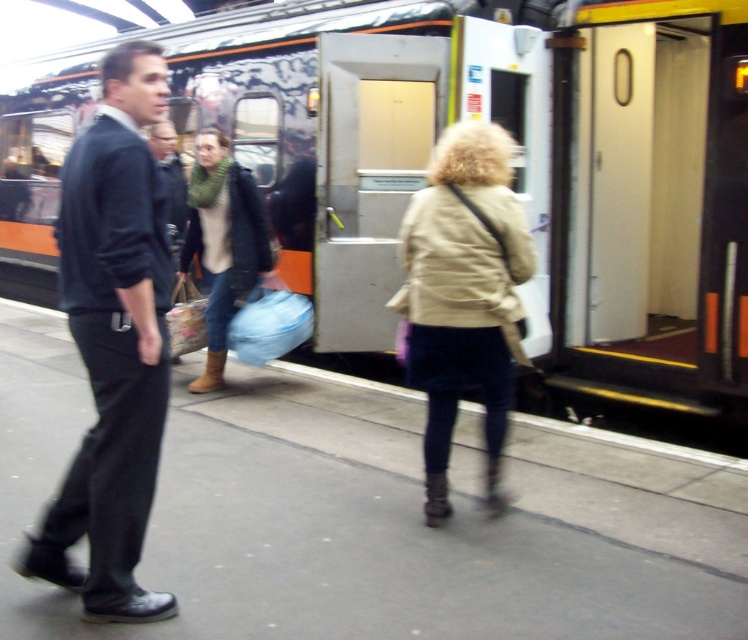
Question: Which of the following is the farthest from the observer?

Choices:
 (A) (307, 179)
 (B) (104, 356)
 (C) (432, 323)

Answer: (A)

Question: Does metallic silver train at center have a lesser width compared to knitted green scarf at center?

Choices:
 (A) yes
 (B) no

Answer: (B)

Question: In this image, where is beige fabric coat at center located relative to knitted green scarf at center?

Choices:
 (A) right
 (B) left

Answer: (A)

Question: Can you confirm if metallic silver train at center is positioned above knitted green scarf at center?

Choices:
 (A) no
 (B) yes

Answer: (B)

Question: Among these objects, which one is nearest to the camera?

Choices:
 (A) metallic silver train at center
 (B) dark blue suit at left
 (C) knitted green scarf at center
 (D) beige fabric coat at center

Answer: (B)

Question: Which point appears farthest from the camera in this image?

Choices:
 (A) (487, 435)
 (B) (649, 353)
 (C) (239, 196)
 (D) (105, 227)

Answer: (B)